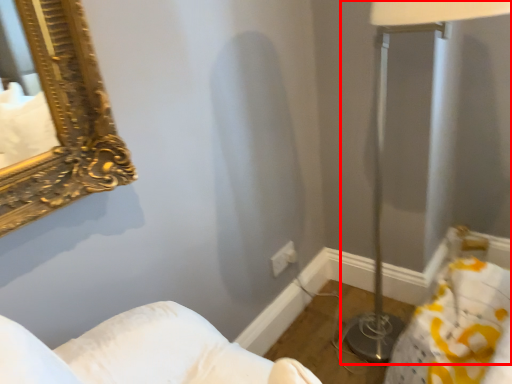
Question: Considering the relative positions of table lamp (annotated by the red box) and electric outlet in the image provided, where is table lamp (annotated by the red box) located with respect to the staircase?

Choices:
 (A) right
 (B) left

Answer: (A)